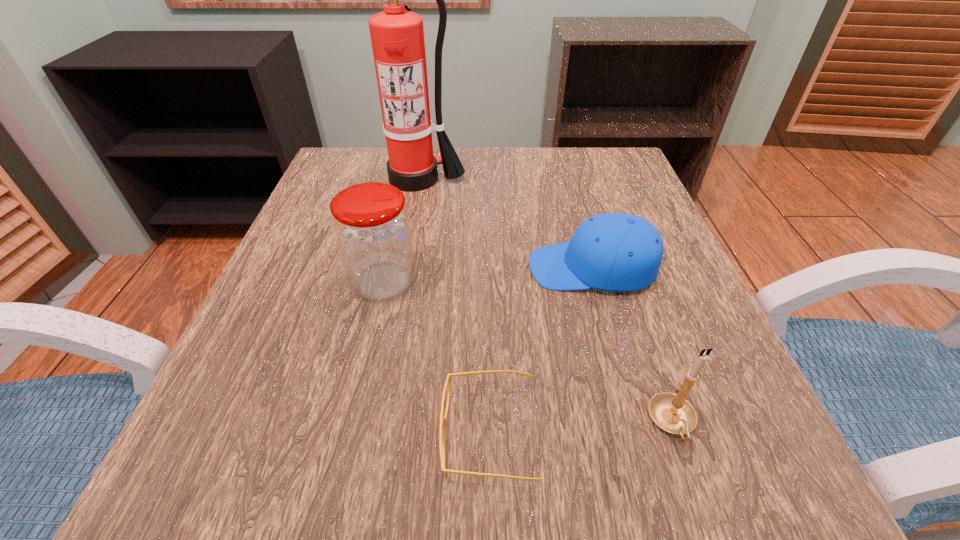
I want to click on free space between the fourth shortest object and the third tallest object, so click(528, 353).

Where is `unoccupied area between the spectacles and the farthest object`? The height and width of the screenshot is (540, 960). unoccupied area between the spectacles and the farthest object is located at coordinates [x=453, y=306].

Where is `free space between the farthest object and the fourth tallest object`? free space between the farthest object and the fourth tallest object is located at coordinates (505, 223).

Identify the location of vacant area that lies between the jar and the spectacles. (436, 358).

This screenshot has height=540, width=960. Identify the location of unoccupied position between the cap and the shortest object. (540, 350).

I want to click on vacant area between the shortest object and the second tallest object, so click(436, 358).

Where is `free space that is in between the third tallest object and the jar`? free space that is in between the third tallest object and the jar is located at coordinates (528, 353).

The image size is (960, 540). Identify the location of free spot between the jar and the cap. (488, 275).

Locate an element on the screen. The height and width of the screenshot is (540, 960). unoccupied position between the candle holder and the fourth tallest object is located at coordinates (633, 346).

You are a GUI agent. You are given a task and a screenshot of the screen. Output one action in this format:
    pyautogui.click(x=<x>, y=<y>)
    Task: Click on the object that is the third closest to the fire extinguisher
    
    Given the screenshot: What is the action you would take?
    pyautogui.click(x=442, y=418)